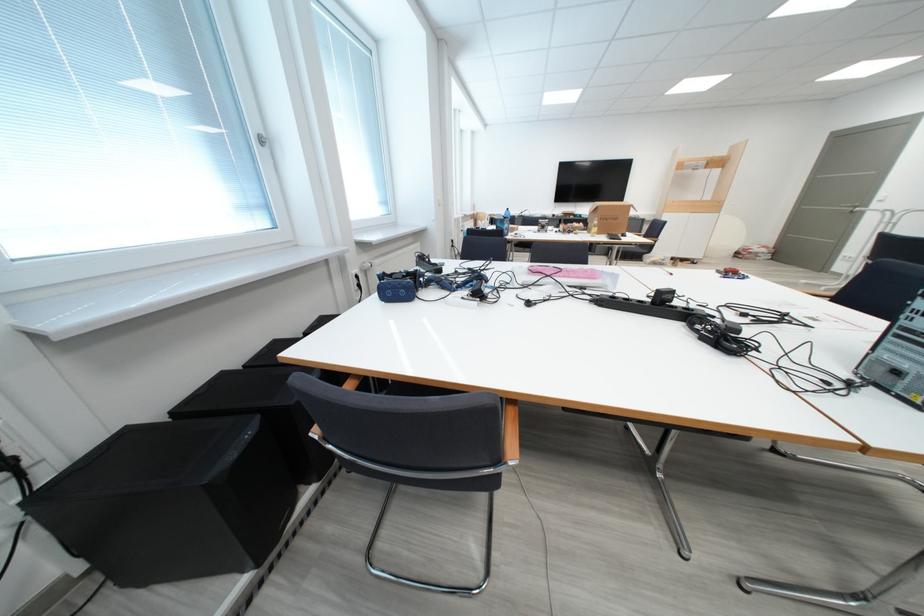
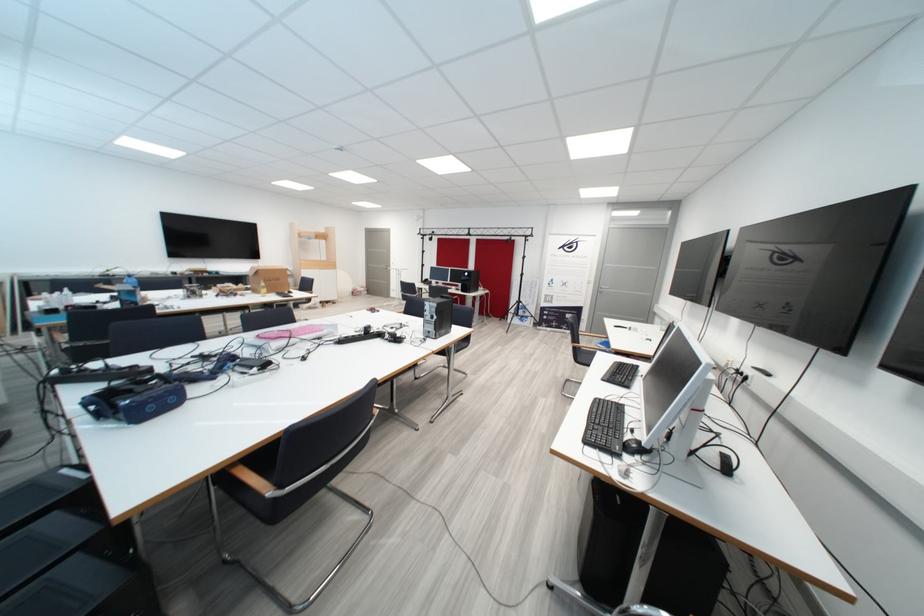
Locate, in the second image, the point that corresponds to (405,290) in the first image.

(168, 400)